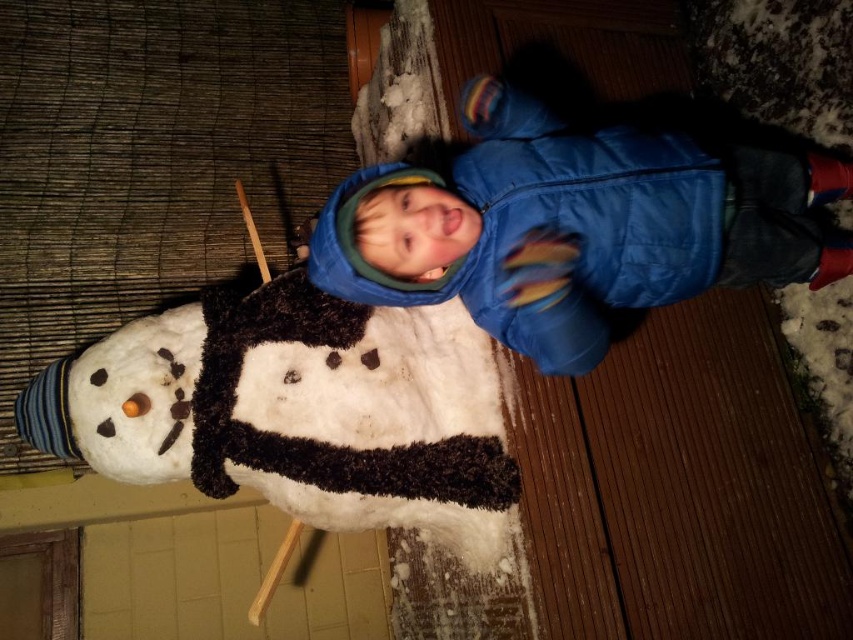
You are a photographer trying to capture both the white fluffy snowman at center and the blue puffy jacket at center in a single frame. Based on their sizes, which object should you focus on first to ensure both fit in the photo?

The white fluffy snowman at center occupies less space than the blue puffy jacket at center, so you should focus on the blue puffy jacket at center first to ensure it fits, and the smaller snowman will naturally be included in the frame.

You are a photographer trying to capture a closeup shot of the snowman while keeping the child in the frame. Given the distance between the white fluffy snowman at center and the blue puffy jacket at center, can you estimate if you can fit both subjects in the frame without moving the camera?

The white fluffy snowman at center is 18.23 inches away from the blue puffy jacket at center. Since this distance is relatively short, it should be possible to capture both subjects in the frame without moving the camera, provided the lens has an appropriate focal length to accommodate the spacing between them.

You are a photographer trying to capture a photo of the white fluffy snowman at center and the blue puffy jacket at center. Since the lighting is dim, you need to adjust your camera settings. Which object should you focus on first if you want to ensure the taller object is in sharp focus?

The white fluffy snowman at center is taller than the blue puffy jacket at center, so you should focus on the white fluffy snowman at center first to ensure it is in sharp focus.